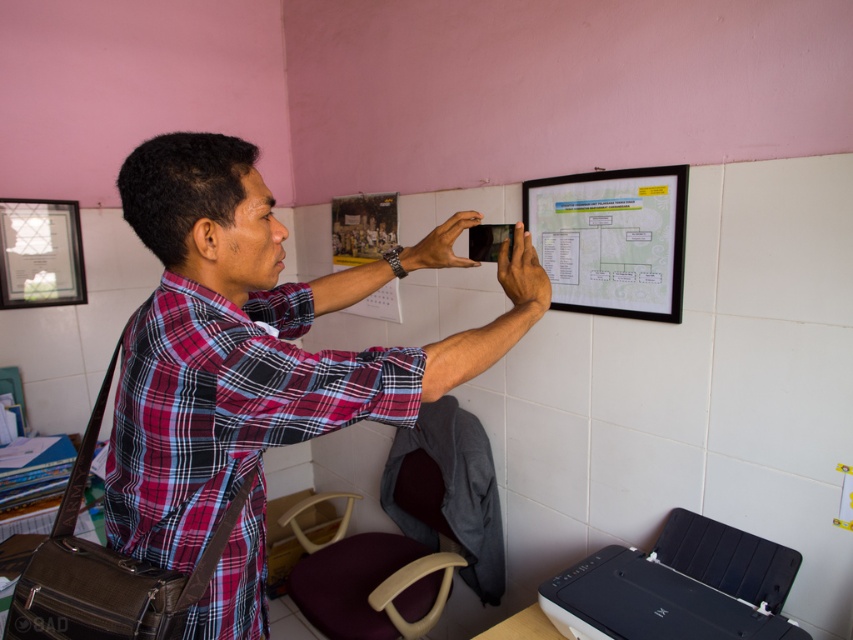
You are organizing a photo shoot and need to ensure all items are visible in the frame. Given that the plaid shirt at center and the black plastic printer at lower right are both in the shot, which item will appear larger in the final photograph?

The plaid shirt at center will appear larger in the final photograph because it is bigger than the black plastic printer at lower right.

You are a photographer needing to position a tripod between the plaid shirt at center and the black plastic printer at lower right. The tripod requires 28 inches of space between the two objects. Is there enough space?

The plaid shirt at center is 31.14 inches from the black plastic printer at lower right, so yes, the tripod can be placed between them as there is sufficient space exceeding the required 28 inches.